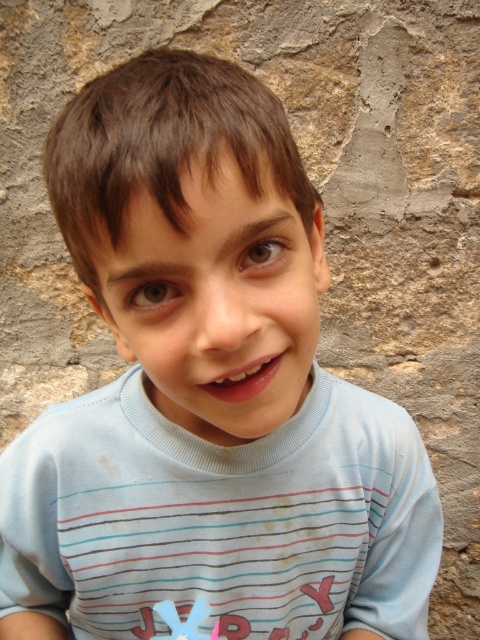
You are a photographer trying to adjust the focus of your camera to capture the light blue cotton shirt at center. What are the coordinates you should aim for?

The coordinates for the light blue cotton shirt at center are at point (222, 518).

You are a photographer trying to capture the child in the image. You want to ensure the light blue cotton shirt at center and the pink plastic toy at lower center are both visible in the frame. Which object should you focus on to ensure both are in the frame?

The light blue cotton shirt at center is wider than the pink plastic toy at lower center, so focusing on the shirt will ensure both objects are within the frame.

You are a photographer setting up for a photo shoot. The subject is wearing a light blue cotton shirt at center and holding a pink plastic toy at lower center. To ensure the toy is visible in the final shot, where should you position the light source relative to the toy and the shirt?

The pink plastic toy at lower center is behind the light blue cotton shirt at center, so positioning the light source in front of the light blue cotton shirt at center will illuminate the toy and prevent it from being obscured by the shirt.